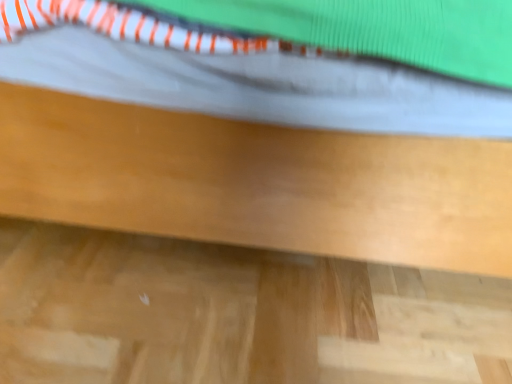
Where is `wooden table at center`? This screenshot has width=512, height=384. wooden table at center is located at coordinates (257, 182).

In order to face wooden table at center, should I rotate leftwards or rightwards?

It's best to rotate left around 2.763 degrees.

Describe the element at coordinates (257, 182) in the screenshot. The image size is (512, 384). I see `wooden table at center` at that location.

Locate an element on the screen. wooden table at center is located at coordinates (257, 182).